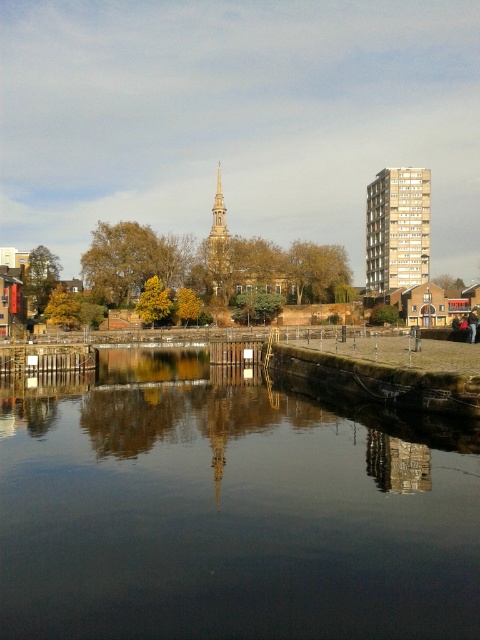
Question: Which object appears farthest from the camera in this image?

Choices:
 (A) gold textured spire at center
 (B) gold metallic building at upper right
 (C) dark reflective water at center

Answer: (B)

Question: Does dark reflective water at center appear over gold metallic building at upper right?

Choices:
 (A) no
 (B) yes

Answer: (A)

Question: Does dark reflective water at center have a lesser width compared to gold textured spire at center?

Choices:
 (A) no
 (B) yes

Answer: (A)

Question: Which of the following is the farthest from the observer?

Choices:
 (A) (419, 248)
 (B) (220, 186)
 (C) (199, 636)

Answer: (B)

Question: Is gold metallic building at upper right bigger than gold textured spire at center?

Choices:
 (A) yes
 (B) no

Answer: (B)

Question: Which object is positioned closest to the dark reflective water at center?

Choices:
 (A) gold textured spire at center
 (B) gold metallic building at upper right

Answer: (A)